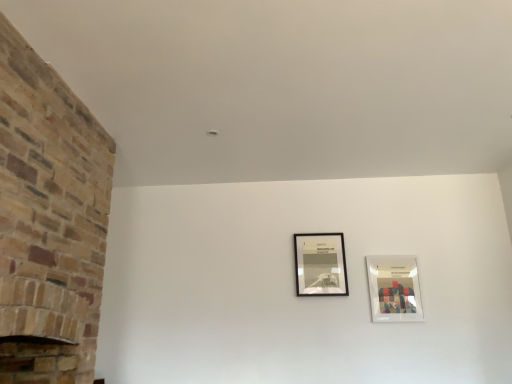
Question: Is black matte picture frame at center, marked as the second picture frame in a right-to-left arrangement, facing away from white glossy picture frame at upper right, marked as the first picture frame in a right-to-left arrangement?

Choices:
 (A) yes
 (B) no

Answer: (B)

Question: Are black matte picture frame at center, the 1th picture frame viewed from the left, and white glossy picture frame at upper right, marked as the first picture frame in a right-to-left arrangement, located far from each other?

Choices:
 (A) no
 (B) yes

Answer: (A)

Question: Is black matte picture frame at center, marked as the second picture frame in a right-to-left arrangement, taller than white glossy picture frame at upper right, marked as the first picture frame in a right-to-left arrangement?

Choices:
 (A) no
 (B) yes

Answer: (B)

Question: Is black matte picture frame at center, the 1th picture frame viewed from the left, aimed at white glossy picture frame at upper right, marked as the first picture frame in a right-to-left arrangement?

Choices:
 (A) no
 (B) yes

Answer: (A)

Question: Can you confirm if black matte picture frame at center, marked as the second picture frame in a right-to-left arrangement, is smaller than white glossy picture frame at upper right, the second picture frame positioned from the left?

Choices:
 (A) yes
 (B) no

Answer: (B)

Question: Do you think brick fireplace at left is within black matte picture frame at center, the 1th picture frame viewed from the left, or outside of it?

Choices:
 (A) outside
 (B) inside

Answer: (A)

Question: From the image's perspective, is brick fireplace at left above or below black matte picture frame at center, marked as the second picture frame in a right-to-left arrangement?

Choices:
 (A) above
 (B) below

Answer: (A)

Question: Does point (15, 57) appear closer or farther from the camera than point (293, 243)?

Choices:
 (A) farther
 (B) closer

Answer: (B)

Question: Considering the positions of brick fireplace at left and black matte picture frame at center, the 1th picture frame viewed from the left, in the image, is brick fireplace at left taller or shorter than black matte picture frame at center, the 1th picture frame viewed from the left,?

Choices:
 (A) tall
 (B) short

Answer: (A)

Question: Is white glossy picture frame at upper right, the second picture frame positioned from the left, wider or thinner than black matte picture frame at center, marked as the second picture frame in a right-to-left arrangement?

Choices:
 (A) thin
 (B) wide

Answer: (A)

Question: Is white glossy picture frame at upper right, marked as the first picture frame in a right-to-left arrangement, to the left or to the right of black matte picture frame at center, the 1th picture frame viewed from the left, in the image?

Choices:
 (A) left
 (B) right

Answer: (B)

Question: Is white glossy picture frame at upper right, marked as the first picture frame in a right-to-left arrangement, bigger or smaller than black matte picture frame at center, the 1th picture frame viewed from the left?

Choices:
 (A) big
 (B) small

Answer: (B)

Question: Is white glossy picture frame at upper right, marked as the first picture frame in a right-to-left arrangement, inside the boundaries of black matte picture frame at center, the 1th picture frame viewed from the left, or outside?

Choices:
 (A) outside
 (B) inside

Answer: (A)

Question: From a real-world perspective, relative to white glossy picture frame at upper right, the second picture frame positioned from the left, is brick fireplace at left vertically above or below?

Choices:
 (A) above
 (B) below

Answer: (A)

Question: Choose the correct answer: Is brick fireplace at left inside white glossy picture frame at upper right, the second picture frame positioned from the left, or outside it?

Choices:
 (A) outside
 (B) inside

Answer: (A)